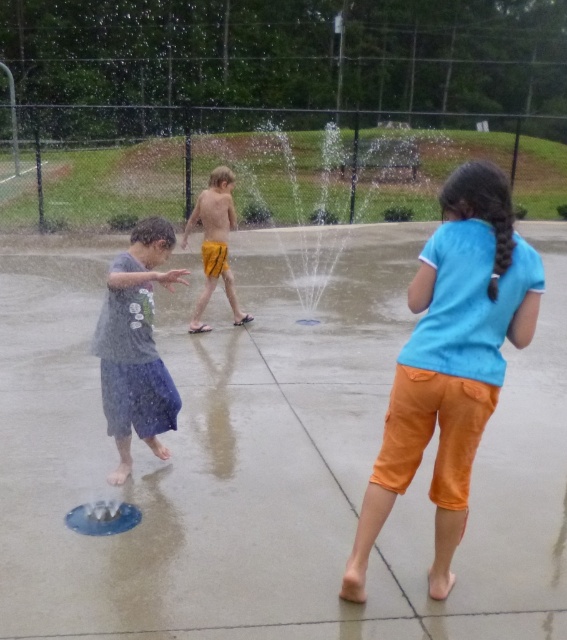
Question: Which point appears farthest from the camera in this image?

Choices:
 (A) (112, 417)
 (B) (200, 323)

Answer: (B)

Question: Which point is closer to the camera taking this photo?

Choices:
 (A) (486, 339)
 (B) (130, 240)
 (C) (211, 196)

Answer: (A)

Question: Is blue cotton shirt at center smaller than gray cotton shirt at left?

Choices:
 (A) yes
 (B) no

Answer: (B)

Question: Is gray cotton shirt at left positioned in front of yellow matte shorts at center?

Choices:
 (A) yes
 (B) no

Answer: (A)

Question: Estimate the real-world distances between objects in this image. Which object is closer to the blue cotton shirt at center?

Choices:
 (A) gray cotton shirt at left
 (B) yellow matte shorts at center

Answer: (A)

Question: Can you confirm if blue cotton shirt at center is positioned above gray cotton shirt at left?

Choices:
 (A) no
 (B) yes

Answer: (A)